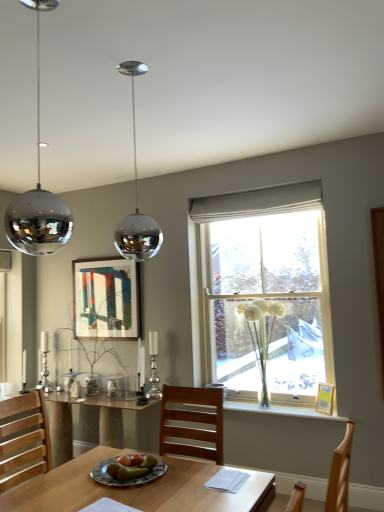
Where is `wooden table at lower left`? Image resolution: width=384 pixels, height=512 pixels. wooden table at lower left is located at coordinates (101, 424).

What do you see at coordinates (101, 424) in the screenshot?
I see `wooden table at lower left` at bounding box center [101, 424].

What do you see at coordinates (106, 298) in the screenshot? The width and height of the screenshot is (384, 512). I see `matte wooden picture frame at upper center, the second picture frame when ordered from right to left` at bounding box center [106, 298].

Where is `white fabric curtain at upper center`? The height and width of the screenshot is (512, 384). white fabric curtain at upper center is located at coordinates (257, 202).

Identify the location of wooden table at lower left. (101, 424).

From a real-world perspective, which is physically below, polished chrome sphere at center or wooden table at lower left?

In real-world perspective, wooden table at lower left is lower.

Based on the photo, from their relative heights in the image, would you say polished chrome sphere at center is taller or shorter than wooden table at lower left?

Clearly, polished chrome sphere at center is taller compared to wooden table at lower left.

Considering the positions of points (301, 189) and (68, 422), is point (301, 189) farther from camera compared to point (68, 422)?

Yes, it is.

From the image's perspective, is white fabric curtain at upper center below wooden table at lower left?

No, from the image's perspective, white fabric curtain at upper center is not beneath wooden table at lower left.

Does white fabric curtain at upper center have a larger size compared to wooden table at lower left?

Incorrect, white fabric curtain at upper center is not larger than wooden table at lower left.

Considering their positions, is white fabric curtain at upper center located in front of or behind wooden table at lower left?

white fabric curtain at upper center is positioned farther from the viewer than wooden table at lower left.

Is white fabric curtain at upper center to the left of matte wooden picture frame at upper center, the second picture frame when ordered from front to back, from the viewer's perspective?

In fact, white fabric curtain at upper center is to the right of matte wooden picture frame at upper center, the second picture frame when ordered from front to back.

From the image's perspective, would you say white fabric curtain at upper center is positioned over matte wooden picture frame at upper center, the 1th picture frame positioned from the top?

Yes, from the image's perspective, white fabric curtain at upper center is on top of matte wooden picture frame at upper center, the 1th picture frame positioned from the top.

Which point is more forward, (x=290, y=199) or (x=122, y=272)?

The point (x=290, y=199) is in front.

Is white fabric curtain at upper center aimed at matte wooden picture frame at upper center, which is counted as the first picture frame, starting from the back?

No, white fabric curtain at upper center is not facing towards matte wooden picture frame at upper center, which is counted as the first picture frame, starting from the back.

From a real-world perspective, which is physically below, wooden table at lower left or polished chrome sphere at center?

wooden table at lower left is physically lower.

Which is correct: wooden table at lower left is inside polished chrome sphere at center, or outside of it?

The correct answer is: outside.

Which object is wider, wooden table at lower left or polished chrome sphere at center?

wooden table at lower left.

Who is bigger, wooden table at lower left or polished chrome sphere at center?

With larger size is wooden table at lower left.

Which object is closer to the camera, wooden picture frame at window, the 2th picture frame viewed from the left, or clear glass vase at center?

wooden picture frame at window, the 2th picture frame viewed from the left.

From the image's perspective, relative to clear glass vase at center, is wooden picture frame at window, the first picture frame when ordered from bottom to top, above or below?

Based on their image positions, wooden picture frame at window, the first picture frame when ordered from bottom to top, is located beneath clear glass vase at center.

How many degrees apart are the facing directions of wooden picture frame at window, positioned as the 2th picture frame in top-to-bottom order, and clear glass vase at center?

The facing directions of wooden picture frame at window, positioned as the 2th picture frame in top-to-bottom order, and clear glass vase at center are 34.1 degrees apart.

Are wooden picture frame at window, the first picture frame when ordered from bottom to top, and clear glass vase at center located far from each other?

That's right, there is a large distance between wooden picture frame at window, the first picture frame when ordered from bottom to top, and clear glass vase at center.

How much distance is there between matte wooden picture frame at upper center, marked as the 2th picture frame in a bottom-to-top arrangement, and clear glass vase at center?

matte wooden picture frame at upper center, marked as the 2th picture frame in a bottom-to-top arrangement, and clear glass vase at center are 3.80 feet apart.

From the image's perspective, is matte wooden picture frame at upper center, the second picture frame when ordered from front to back, over clear glass vase at center?

Yes, from the image's perspective, matte wooden picture frame at upper center, the second picture frame when ordered from front to back, is above clear glass vase at center.

Considering the sizes of objects matte wooden picture frame at upper center, which is counted as the first picture frame, starting from the back, and clear glass vase at center in the image provided, who is bigger, matte wooden picture frame at upper center, which is counted as the first picture frame, starting from the back, or clear glass vase at center?

clear glass vase at center.

Is matte wooden picture frame at upper center, the 1th picture frame positioned from the top, turned away from clear glass vase at center?

No.

Is point (266, 359) in front of point (318, 251)?

No.

Who is taller, white fluffy flowers at window or clear glass vase at center?

Standing taller between the two is clear glass vase at center.

How different are the orientations of white fluffy flowers at window and clear glass vase at center in degrees?

1.64 degrees separate the facing orientations of white fluffy flowers at window and clear glass vase at center.

Does white fluffy flowers at window appear on the right side of clear glass vase at center?

No, white fluffy flowers at window is not to the right of clear glass vase at center.

Where is `table lying behind the polished chrome sphere at center`? table lying behind the polished chrome sphere at center is located at coordinates (101, 424).

Locate an element on the screen. Image resolution: width=384 pixels, height=512 pixels. table on the left of white fabric curtain at upper center is located at coordinates (101, 424).

Consider the image. Considering their positions, is polished chrome sphere at center positioned further to green matte plate at center than wooden table at lower left?

The object further to green matte plate at center is wooden table at lower left.

Based on the photo, considering their positions, is wooden picture frame at window, which appears as the first picture frame when viewed from the front, positioned closer to wooden table at lower left than green matte plate at center?

Based on the image, green matte plate at center appears to be nearer to wooden table at lower left.

Looking at the image, which one is located closer to white fabric curtain at upper center, white glass vase at center or clear glass vase at center?

clear glass vase at center.

Which object lies further to the anchor point matte wooden picture frame at upper center, the second picture frame when ordered from front to back, white glass vase at center or wooden table at lower left?

The object further to matte wooden picture frame at upper center, the second picture frame when ordered from front to back, is white glass vase at center.

From the image, which object appears to be nearer to white fluffy flowers at window, polished chrome sphere at center or matte wooden picture frame at upper center, marked as the 2th picture frame in a bottom-to-top arrangement?

Among the two, matte wooden picture frame at upper center, marked as the 2th picture frame in a bottom-to-top arrangement, is located nearer to white fluffy flowers at window.

Considering their positions, is white glass vase at center positioned closer to polished chrome sphere at center than wooden table at lower left?

white glass vase at center.

Estimate the real-world distances between objects in this image. Which object is closer to white fabric curtain at upper center, polished chrome sphere at center or white glass vase at center?

white glass vase at center is positioned closer to the anchor white fabric curtain at upper center.

Which object lies nearer to the anchor point white fabric curtain at upper center, matte wooden picture frame at upper center, marked as the 2th picture frame in a bottom-to-top arrangement, or wooden picture frame at window, which appears as the first picture frame when viewed from the front?

matte wooden picture frame at upper center, marked as the 2th picture frame in a bottom-to-top arrangement, is closer to white fabric curtain at upper center.

Where is `window sill between green matte plate at center and wooden picture frame at window, which is counted as the 1th picture frame, starting from the right, in the horizontal direction`? The width and height of the screenshot is (384, 512). window sill between green matte plate at center and wooden picture frame at window, which is counted as the 1th picture frame, starting from the right, in the horizontal direction is located at coordinates (280, 410).

Where is `flower between white fabric curtain at upper center and white glass vase at center in the vertical direction`? The height and width of the screenshot is (512, 384). flower between white fabric curtain at upper center and white glass vase at center in the vertical direction is located at coordinates (261, 334).

Locate an element on the screen. The height and width of the screenshot is (512, 384). curtain between polished chrome sphere at center and wooden picture frame at window, which is counted as the 1th picture frame, starting from the right, from top to bottom is located at coordinates (257, 202).

The width and height of the screenshot is (384, 512). Identify the location of flower between wooden table at lower left and clear glass vase at center from left to right. 261,334.